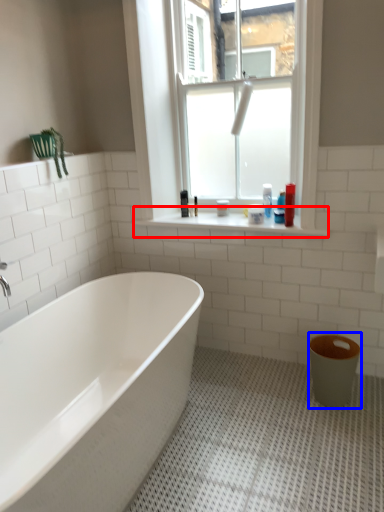
Question: Which object appears farthest to the camera in this image, window sill (highlighted by a red box) or toilet bowl (highlighted by a blue box)?

Choices:
 (A) window sill
 (B) toilet bowl

Answer: (A)